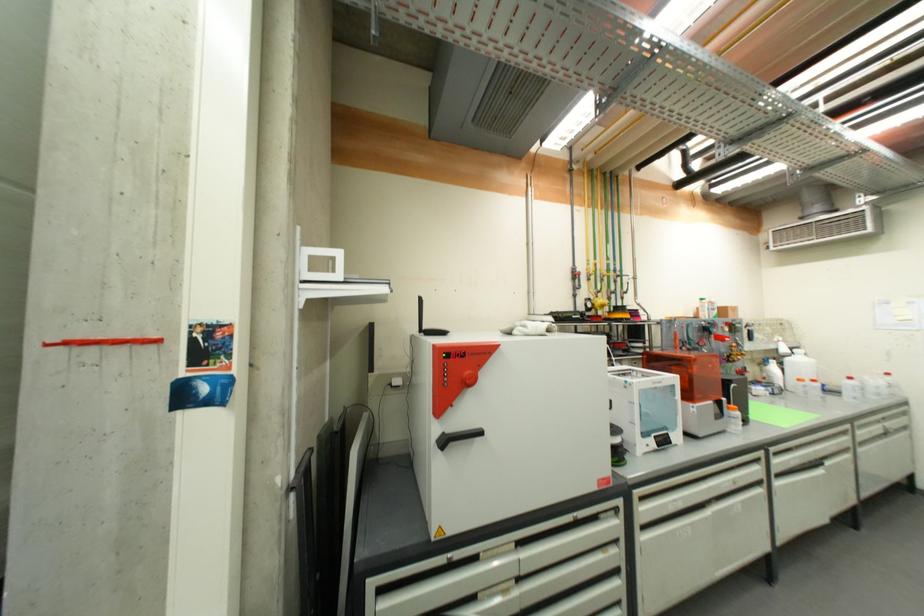
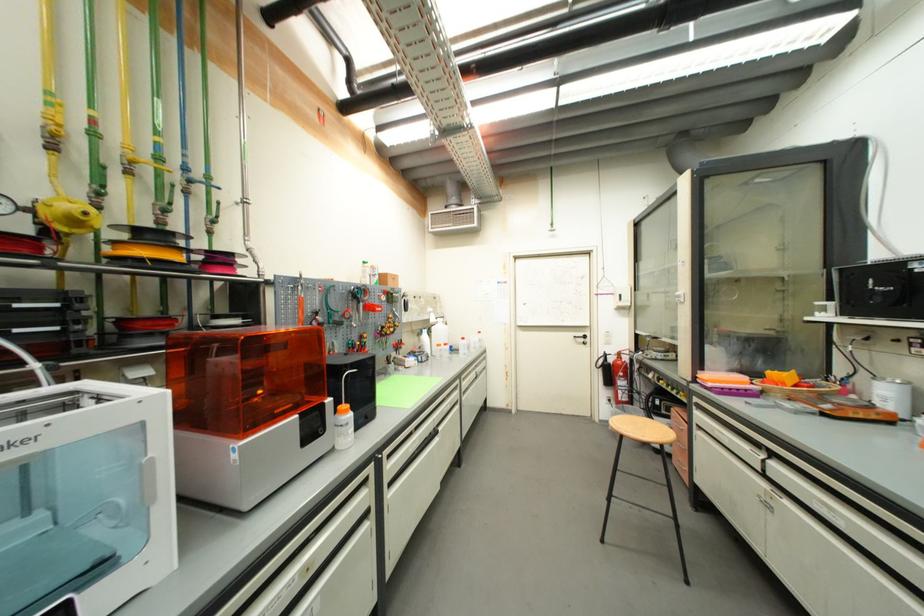
Find the pixel in the second image that matches (x=613, y=293) in the first image.

(160, 207)